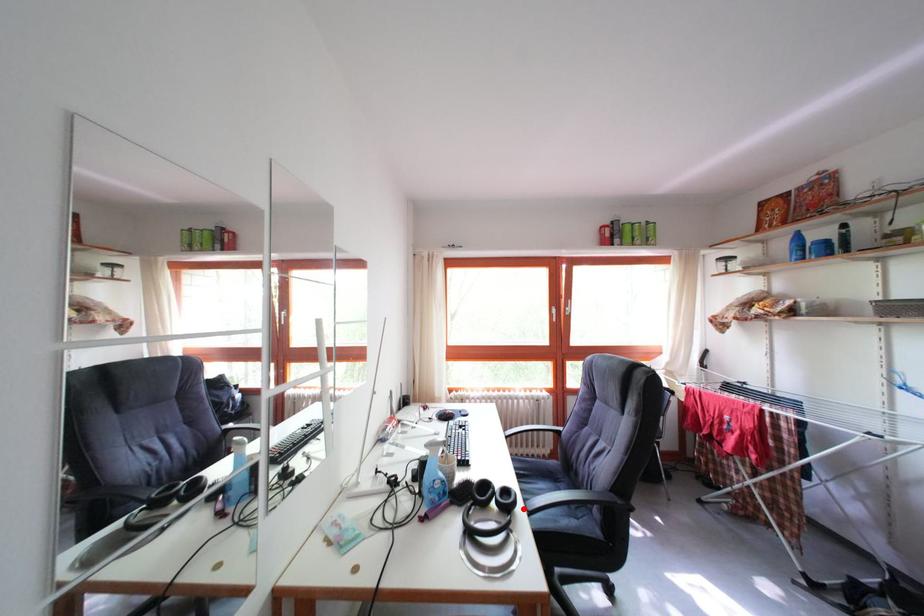
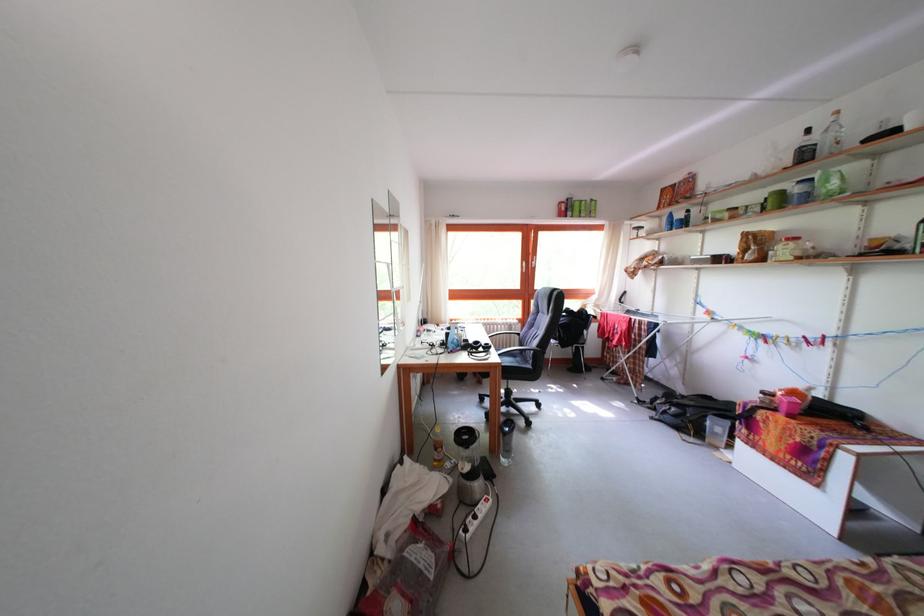
Question: I am providing you with two images of the same scene from different viewpoints. A red point is marked on the first image. At the location where the point appears in image 1, is it still visible in image 2?

Choices:
 (A) Yes
 (B) No

Answer: (A)